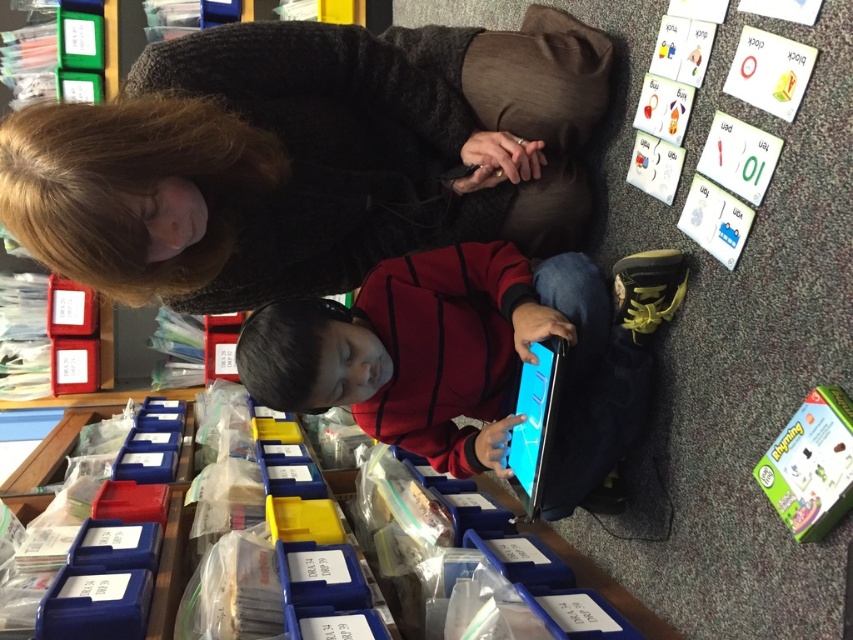
Who is more distant from viewer, (428, 81) or (543, 442)?

The point (428, 81) is more distant.

Based on the photo, is dark gray sweater at upper center further to the viewer compared to matte black tablet at center?

No, dark gray sweater at upper center is closer to the viewer.

What do you see at coordinates (311, 156) in the screenshot? I see `dark gray sweater at upper center` at bounding box center [311, 156].

This screenshot has width=853, height=640. Find the location of `dark gray sweater at upper center`. dark gray sweater at upper center is located at coordinates (311, 156).

Is point (161, 104) in front of point (495, 372)?

That is True.

Is dark gray sweater at upper center above smooth black tablet at center?

Indeed, dark gray sweater at upper center is positioned over smooth black tablet at center.

Measure the distance between dark gray sweater at upper center and camera.

dark gray sweater at upper center and camera are 32.82 inches apart.

Locate an element on the screen. dark gray sweater at upper center is located at coordinates (311, 156).

Does smooth black tablet at center have a greater height compared to matte black tablet at center?

Correct, smooth black tablet at center is much taller as matte black tablet at center.

Is smooth black tablet at center thinner than matte black tablet at center?

No, smooth black tablet at center is not thinner than matte black tablet at center.

Where is `smooth black tablet at center`? smooth black tablet at center is located at coordinates (471, 356).